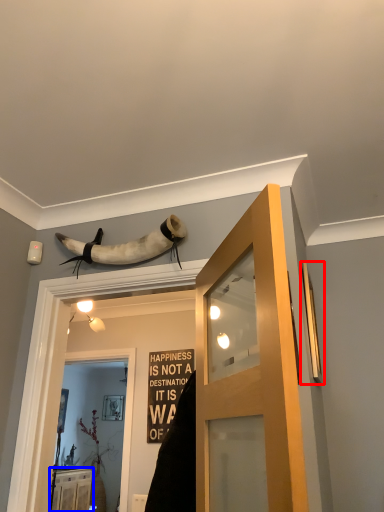
Question: Among these objects, which one is farthest to the camera, window (highlighted by a red box) or cabinetry (highlighted by a blue box)?

Choices:
 (A) window
 (B) cabinetry

Answer: (B)